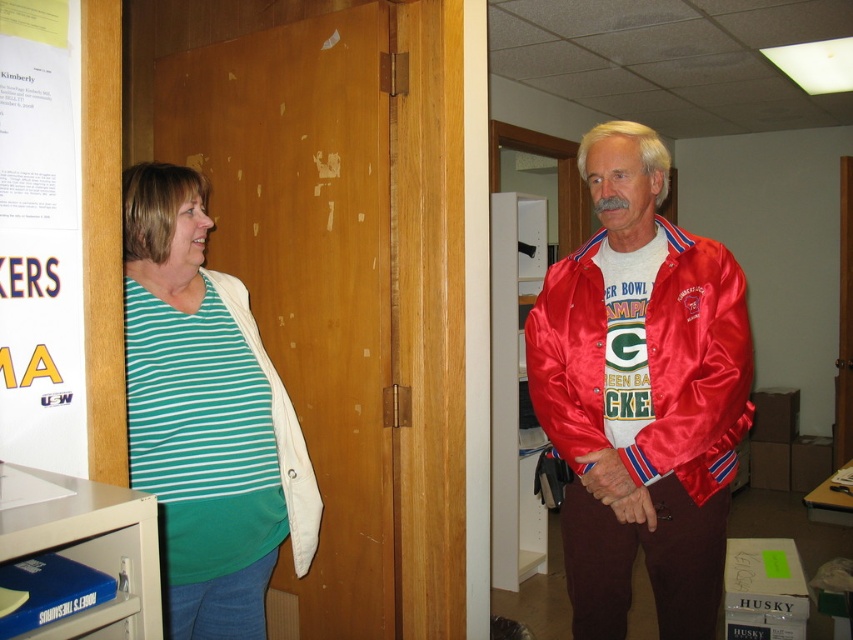
Question: Which point is closer to the camera taking this photo?

Choices:
 (A) (190, 493)
 (B) (699, 614)
 (C) (293, 378)

Answer: (A)

Question: Among these objects, which one is nearest to the camera?

Choices:
 (A) green striped shirt at left
 (B) satin red jacket at right
 (C) white paper poster at left
 (D) green matte bulletin board at left

Answer: (C)

Question: Is satin red jacket at right to the left of white paper poster at left from the viewer's perspective?

Choices:
 (A) yes
 (B) no

Answer: (B)

Question: Is the position of green matte bulletin board at left more distant than that of white paper poster at left?

Choices:
 (A) yes
 (B) no

Answer: (A)

Question: Which of the following is the farthest from the observer?

Choices:
 (A) (175, 330)
 (B) (608, 218)

Answer: (B)

Question: Does green matte bulletin board at left have a smaller size compared to white paper poster at left?

Choices:
 (A) no
 (B) yes

Answer: (A)